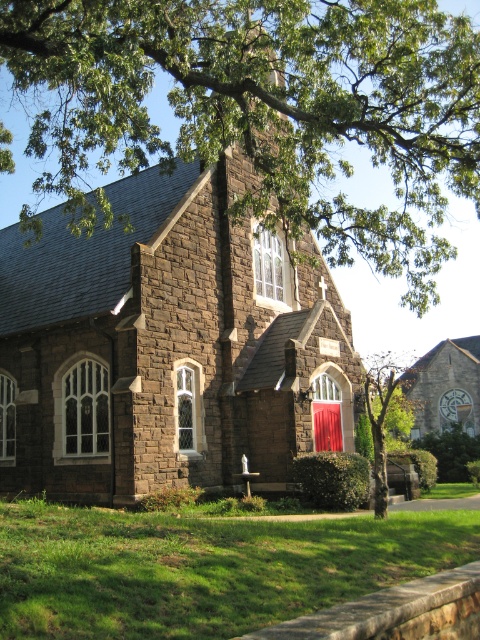
You are an architect analyzing the spatial relationship between the brown stone chapel at center and the green leafy tree at upper center. Which object has a narrower width?

The brown stone chapel at center is thinner than the green leafy tree at upper center, so the brown stone chapel at center has a narrower width.

You are standing in front of the church and notice a point marked at coordinates (x=263, y=108). Based on the scene description, what object is located at that point?

The point at coordinates (x=263, y=108) marks the location of a green leafy tree at upper center.

You are standing in front of the brown stone chapel at center and looking towards the green leafy tree at upper center. Which object is closer to you?

The brown stone chapel at center is closer to you because it is positioned in front of the green leafy tree at upper center, which is further away.